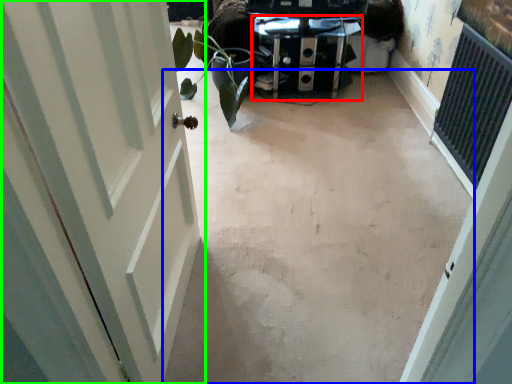
Question: Which is nearer to the furniture (highlighted by a red box)? concrete (highlighted by a blue box) or door (highlighted by a green box).

Choices:
 (A) concrete
 (B) door

Answer: (A)